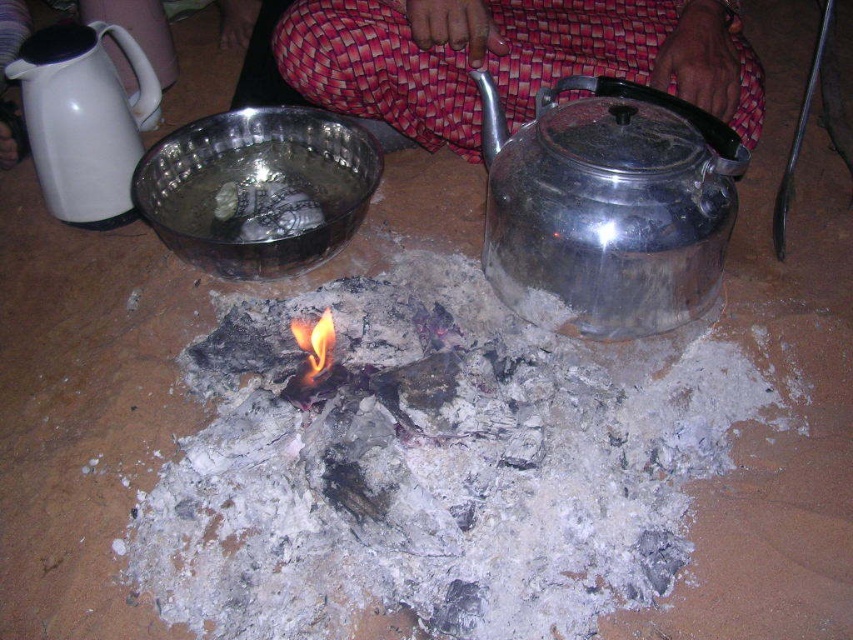
You are preparing to boil water for tea. You have a shiny metallic teapot at right and a red woven pants at center. Which container can hold more water?

The red woven pants at center can hold more water because it is larger than the shiny metallic teapot at right.

You are a chef preparing a meal around the fire pit. You need to place both the charcoal ash at center and the red woven pants at center on a shelf. The shelf can only hold items where the smaller one is placed below the larger one. Which item should go on the bottom shelf?

The red woven pants at center should be placed on the bottom shelf because it is smaller in size than the charcoal ash at center, so the smaller item goes below the larger one.